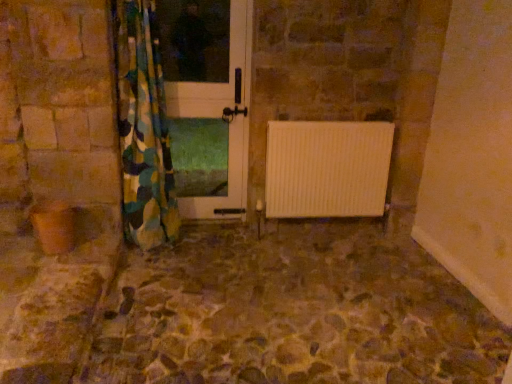
Question: Considering the positions of point [374, 289] and point [212, 208], is point [374, 289] closer or farther from the camera than point [212, 208]?

Choices:
 (A) closer
 (B) farther

Answer: (A)

Question: Is stone textured floor at center wider or thinner than white glossy door at center?

Choices:
 (A) thin
 (B) wide

Answer: (B)

Question: Which object is the farthest from the camouflage fabric curtain at left?

Choices:
 (A) stone textured floor at center
 (B) white glossy door at center

Answer: (A)

Question: Based on their relative distances, which object is farther from the white glossy door at center?

Choices:
 (A) stone textured floor at center
 (B) camouflage fabric curtain at left

Answer: (A)